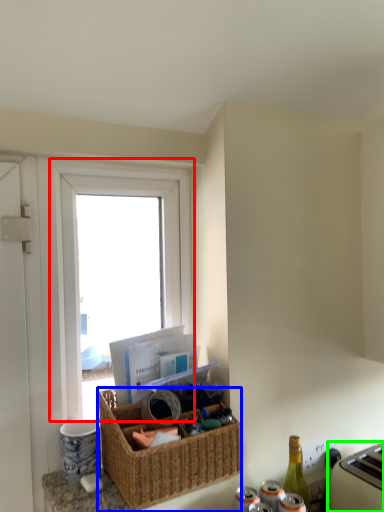
Question: Which object is positioned closest to window (highlighted by a red box)? Select from picnic basket (highlighted by a blue box) and appliance (highlighted by a green box).

Choices:
 (A) picnic basket
 (B) appliance

Answer: (A)